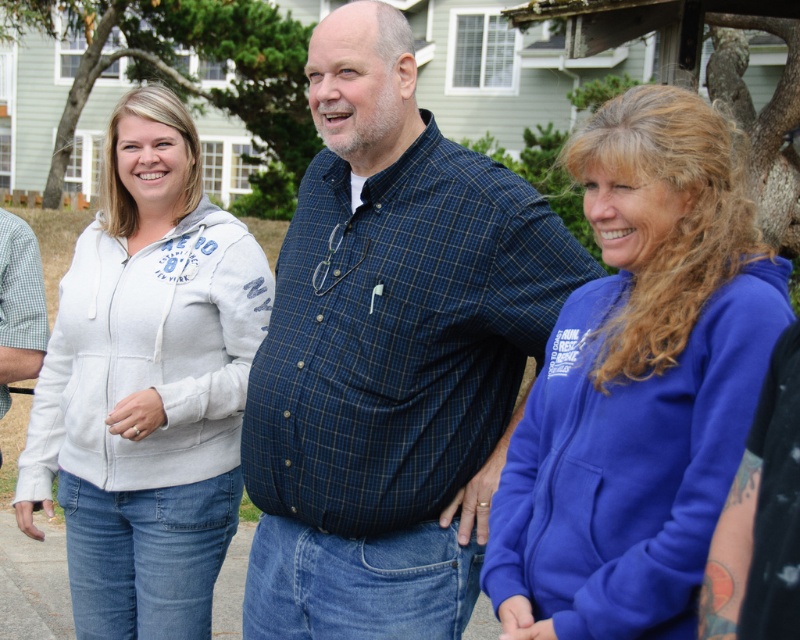
Consider the image. Does light gray fleece jacket at center have a larger size compared to white gingham shirt at left?

Yes.

Which is in front, point (198, 380) or point (50, 504)?

Point (198, 380) is more forward.

Find the location of a particular element. The height and width of the screenshot is (640, 800). light gray fleece jacket at center is located at coordinates (148, 385).

How much distance is there between blue fleece jacket at right and white gingham shirt at left?

A distance of 7.80 feet exists between blue fleece jacket at right and white gingham shirt at left.

Is point (728, 188) farther from camera compared to point (28, 300)?

No, it is in front of (28, 300).

At what (x,y) coordinates should I click in order to perform the action: click on blue fleece jacket at right. Please return your answer as a coordinate pair (x, y). This screenshot has width=800, height=640. Looking at the image, I should click on (638, 381).

The width and height of the screenshot is (800, 640). Find the location of `blue fleece jacket at right`. blue fleece jacket at right is located at coordinates (638, 381).

Does blue fleece jacket at right come behind light gray fleece jacket at center?

No, blue fleece jacket at right is closer to the viewer.

Is point (706, 161) behind point (128, 106)?

No, (706, 161) is closer to viewer.

Between point (528, 452) and point (145, 636), which one is positioned behind?

The point (145, 636) is more distant.

Find the location of a particular element. blue fleece jacket at right is located at coordinates (638, 381).